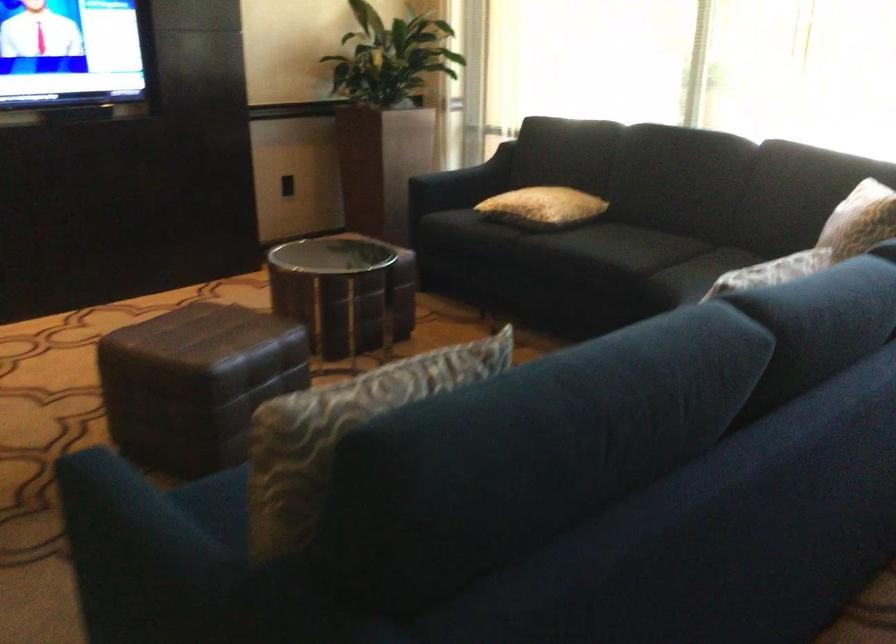
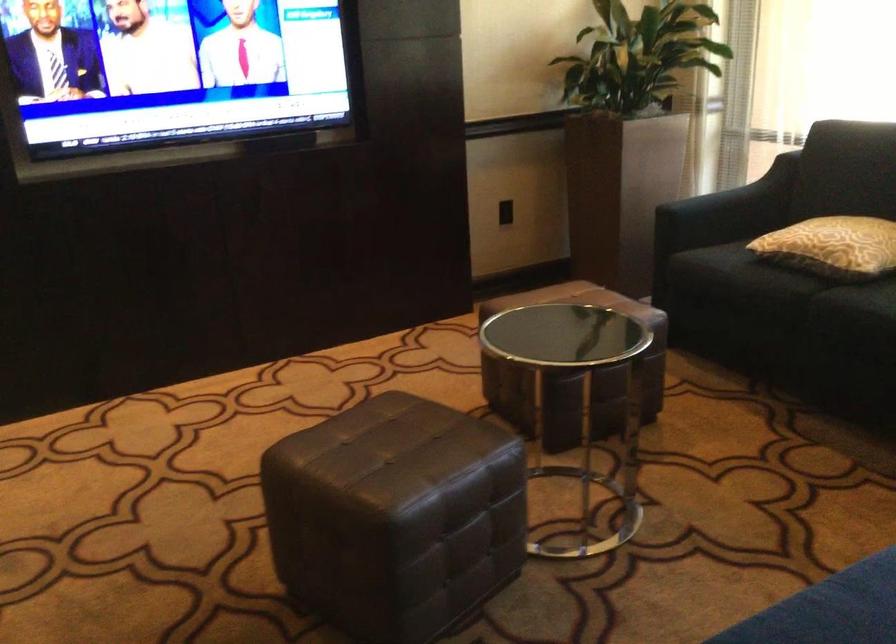
In the second image, find the point that corresponds to pixel 487 236 in the first image.

(767, 283)